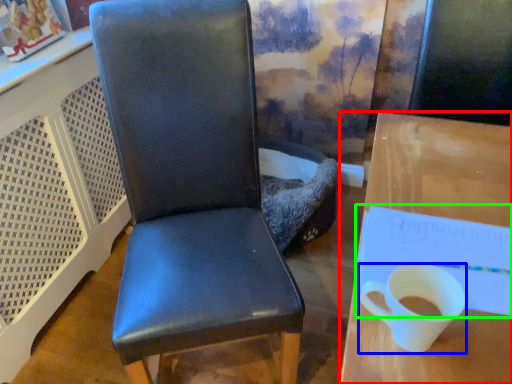
Question: Estimate the real-world distances between objects in this image. Which object is closer to desk (highlighted by a red box), coffee cup (highlighted by a blue box) or notepad (highlighted by a green box)?

Choices:
 (A) coffee cup
 (B) notepad

Answer: (B)